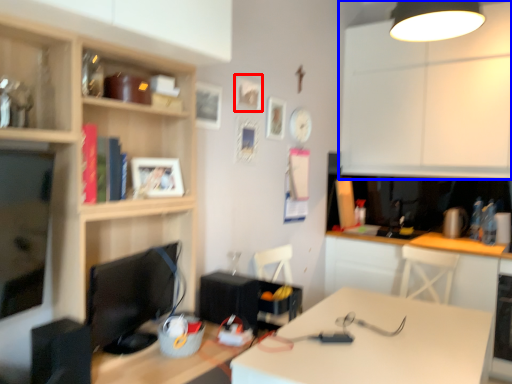
Question: Which of the following is the farthest to the observer, picture frame (highlighted by a red box) or cabinetry (highlighted by a blue box)?

Choices:
 (A) picture frame
 (B) cabinetry

Answer: (B)